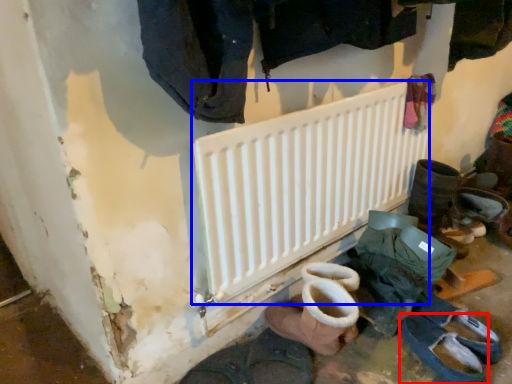
Question: Which point is further to the camera, footwear (highlighted by a red box) or radiator (highlighted by a blue box)?

Choices:
 (A) footwear
 (B) radiator

Answer: (A)